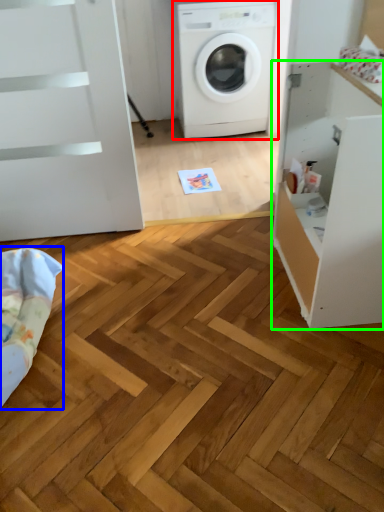
Question: Considering the real-world distances, which object is farthest from washing machine (highlighted by a red box)? bedding (highlighted by a blue box) or file cabinet (highlighted by a green box)?

Choices:
 (A) bedding
 (B) file cabinet

Answer: (A)